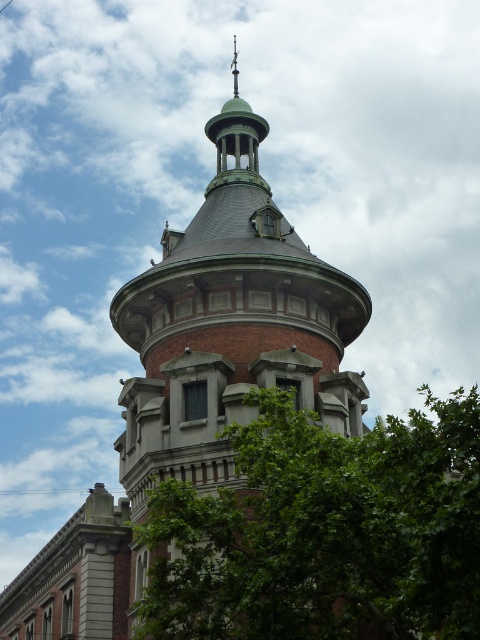
You are standing in a park and see the green leafy tree at center and the red brick tower at center. Which object is closer to you?

The green leafy tree at center is closer to you because it is in front of the red brick tower at center.

You are standing in front of the red brick tower at center and want to take a photo of it. However, there is a green leafy tree at center blocking your view. Can you determine if the tree is wider than the tower?

The green leafy tree at center is wider than the red brick tower at center, so the tree is blocking the view of the tower.